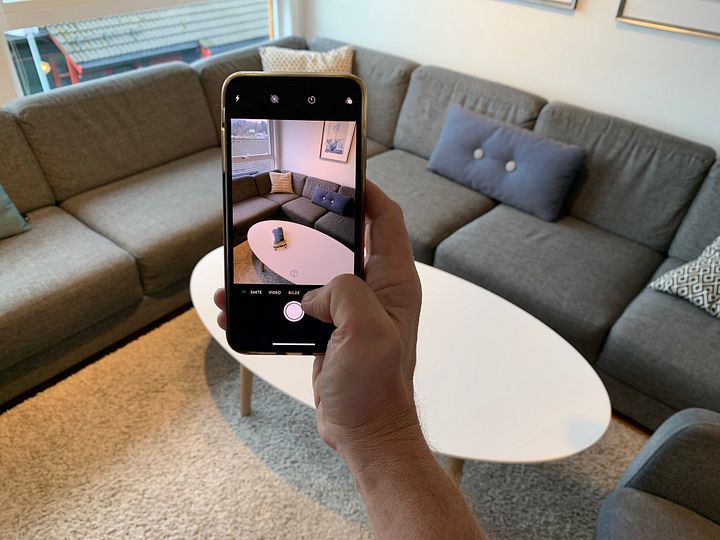
Where is `brass picture frame`? brass picture frame is located at coordinates (651, 23).